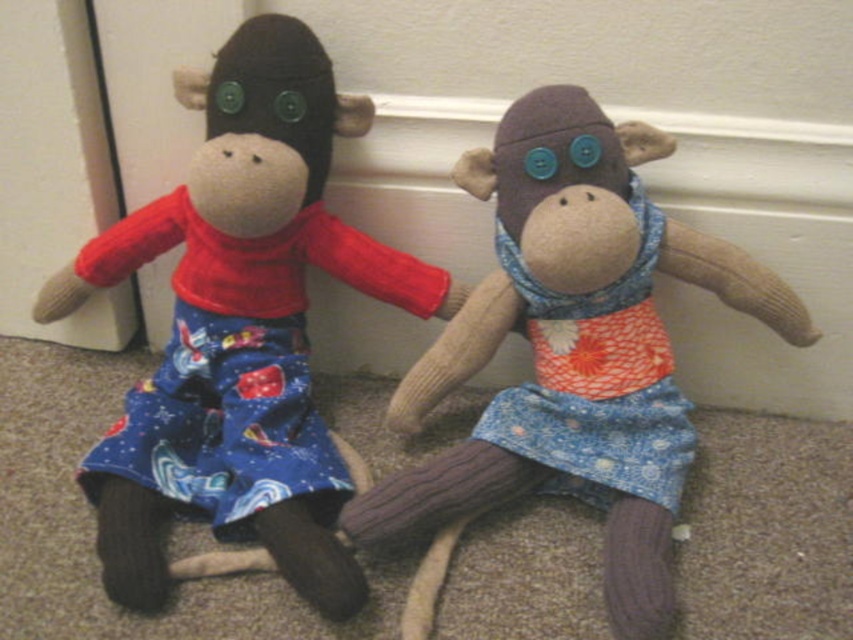
You are a toy organizer trying to stack the matte red sweater at left and the matte fabric monkey at left on a shelf. Which item should you place first to ensure stability?

The matte red sweater at left is taller than the matte fabric monkey at left, so place the shorter item first to ensure stability.

Based on the photo, you are standing in front of the two monkey dolls. You need to find the matte red sweater at left. Where is it located relative to the point marked at coordinates [241,326]?

The point at coordinates [241,326] marks the location of the matte red sweater at left, so it is exactly at that point.

You are a toy collector who wants to place the two monkey dolls on a shelf that is 90 centimeters wide. The shelf has no other items. Can the two monkey dolls, specifically the matte red sweater at left and the other doll, fit side by side on the shelf without overlapping?

The two monkey dolls are 86.10 centimeters apart. Since the shelf is 90 centimeters wide, there is enough space for them to fit side by side without overlapping.